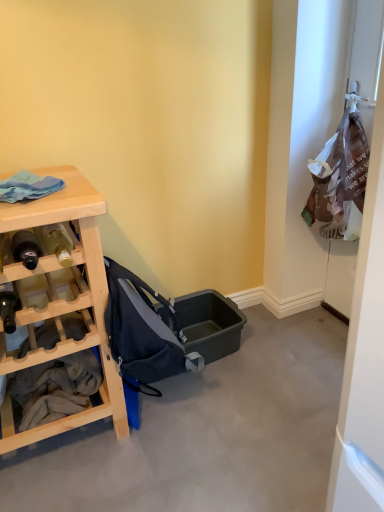
The image size is (384, 512). In order to click on free spot to the right of natural wood desk at left in this screenshot , I will do `click(192, 433)`.